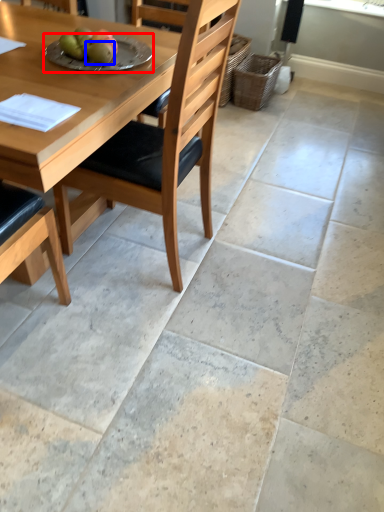
Question: Which object is closer to the camera taking this photo, plate (highlighted by a red box) or fruit (highlighted by a blue box)?

Choices:
 (A) plate
 (B) fruit

Answer: (B)